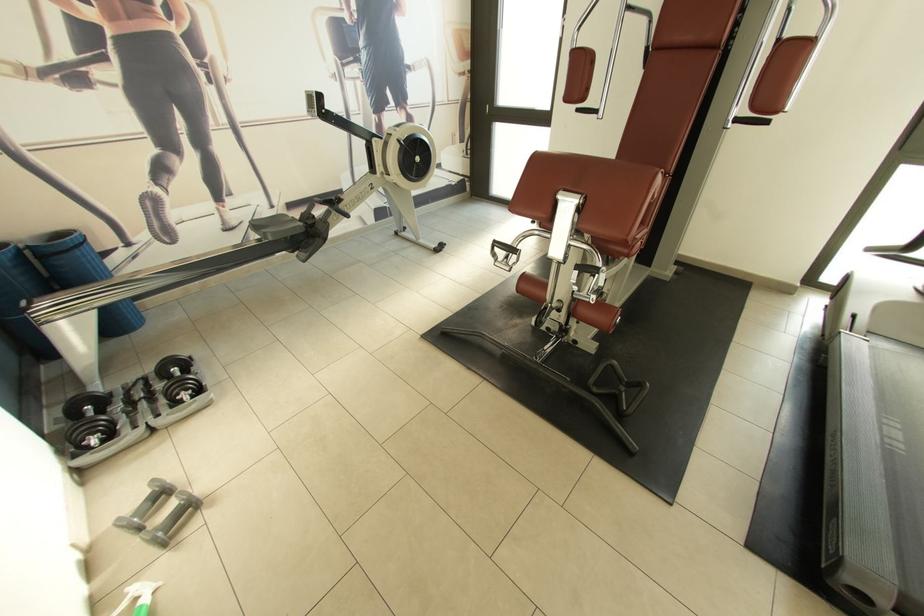
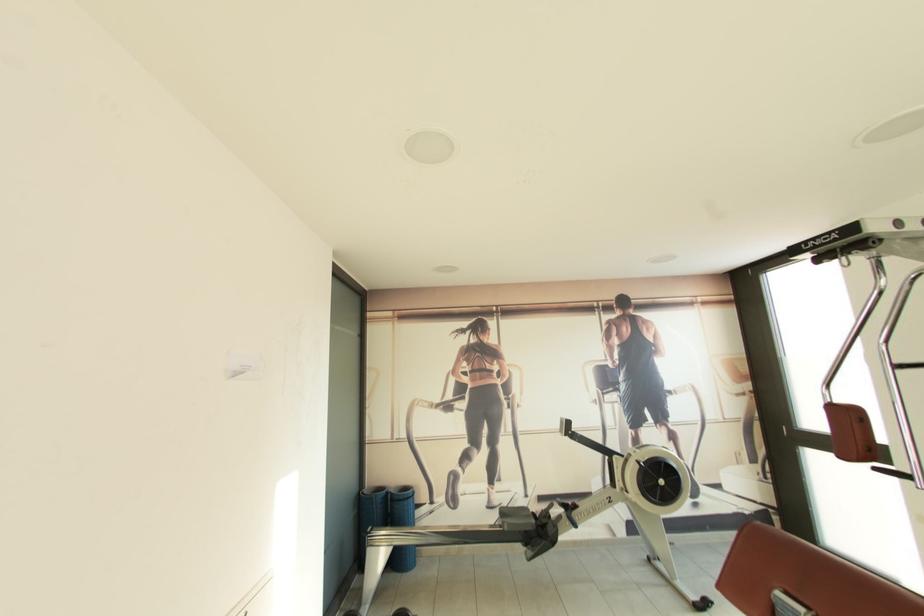
Looking at this image, based on the continuous images, in which direction is the camera rotating?

The camera rotated toward left-up.